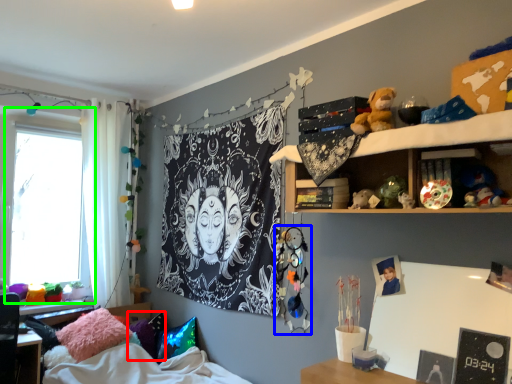
Question: Based on their relative distances, which object is farther from pillow (highlighted by a red box)? Choose from toy (highlighted by a blue box) and window (highlighted by a green box).

Choices:
 (A) toy
 (B) window

Answer: (A)